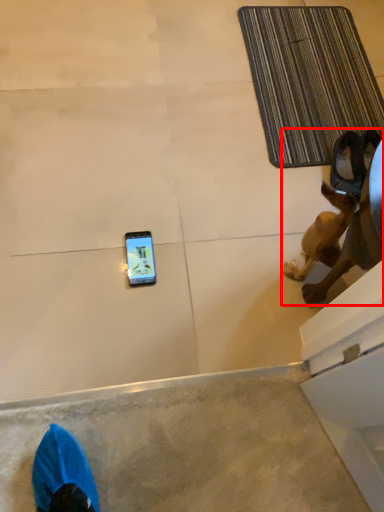
Question: From the image's perspective, what is the correct spatial relationship of animal (annotated by the red box) in relation to bath mat?

Choices:
 (A) below
 (B) above

Answer: (A)